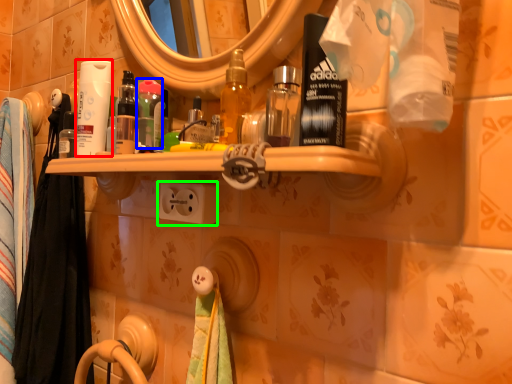
Question: Based on their relative distances, which object is farther from toilet paper (highlighted by a red box)? Choose from mouthwash (highlighted by a blue box) and electric outlet (highlighted by a green box).

Choices:
 (A) mouthwash
 (B) electric outlet

Answer: (B)